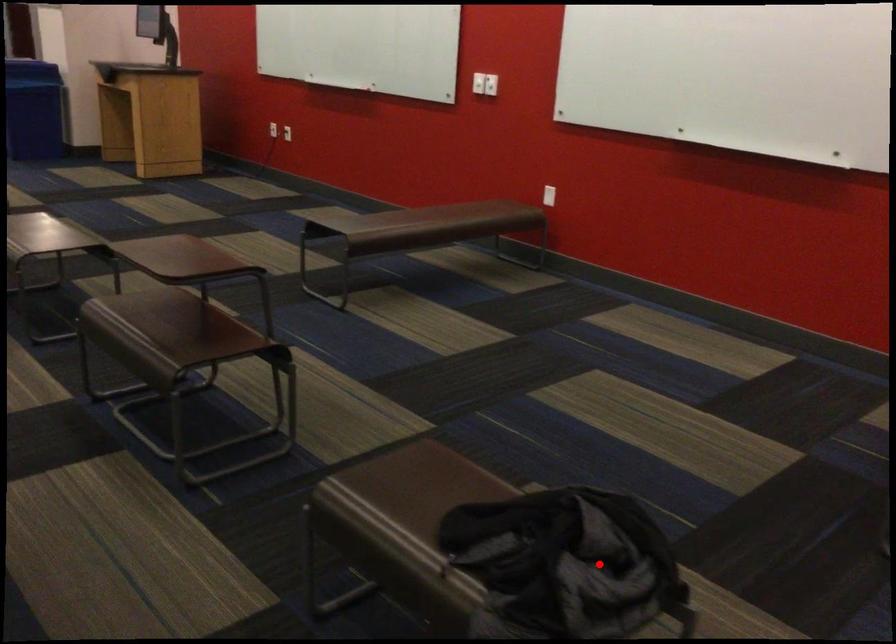
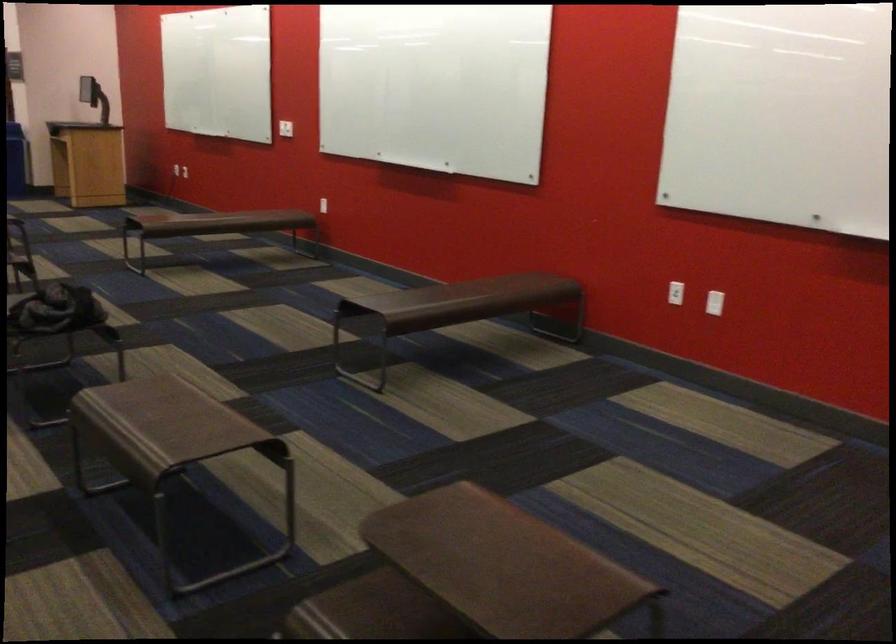
In the second image, find the point that corresponds to the highlighted location in the first image.

(56, 310)